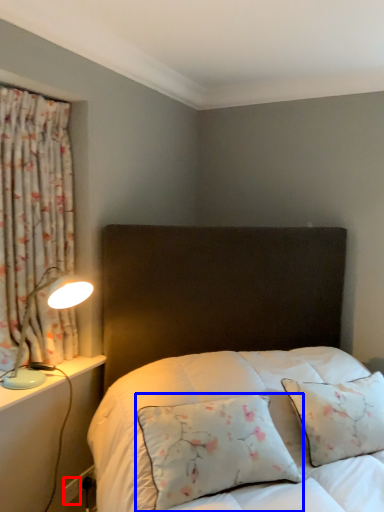
Question: Which object is further to the camera taking this photo, electric outlet (highlighted by a red box) or pillow (highlighted by a blue box)?

Choices:
 (A) electric outlet
 (B) pillow

Answer: (A)